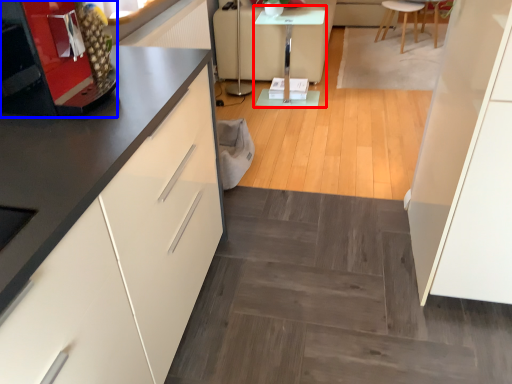
Question: Which point is further to the camera, table (highlighted by a red box) or appliance (highlighted by a blue box)?

Choices:
 (A) table
 (B) appliance

Answer: (A)